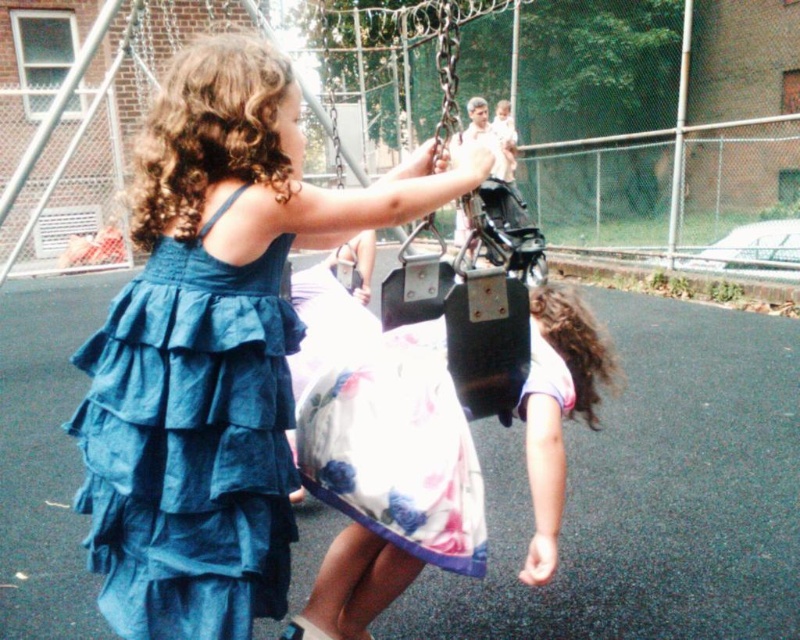
You are taking a photo of the playground scene. You notice two points marked in the image at coordinates point (108, 364) and point (568, 408). Which point should you focus on to ensure the foreground is sharp?

You should focus on point (108, 364) because it is closer to the camera than point (568, 408), ensuring the foreground elements remain sharp.

You are a photographer trying to capture the two children in the playground scene. You notice the floral satin dress at center and the white floral dress at center. Which dress is positioned higher in the image?

The floral satin dress at center is positioned higher in the image than the white floral dress at center.